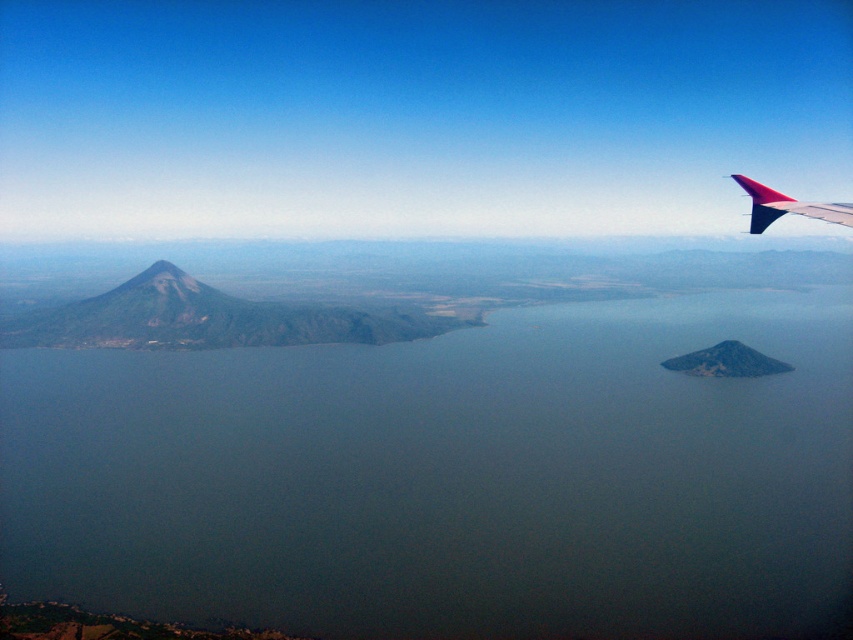
Question: Is green matte water at center positioned in front of polished aluminum winglet at upper right?

Choices:
 (A) no
 (B) yes

Answer: (A)

Question: Which object is farther from the camera taking this photo?

Choices:
 (A) polished aluminum winglet at upper right
 (B) green matte water at center

Answer: (B)

Question: Can you confirm if green matte water at center is smaller than polished aluminum winglet at upper right?

Choices:
 (A) yes
 (B) no

Answer: (B)

Question: Among these objects, which one is nearest to the camera?

Choices:
 (A) polished aluminum winglet at upper right
 (B) green matte water at center

Answer: (A)

Question: In this image, where is green matte water at center located relative to polished aluminum winglet at upper right?

Choices:
 (A) above
 (B) below

Answer: (B)